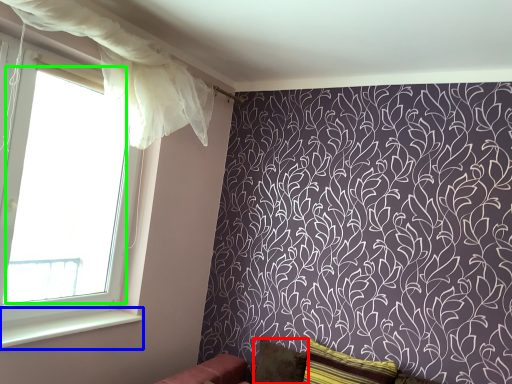
Question: Based on their relative distances, which object is farther from pillow (highlighted by a red box)? Choose from window sill (highlighted by a blue box) and window screen (highlighted by a green box).

Choices:
 (A) window sill
 (B) window screen

Answer: (B)